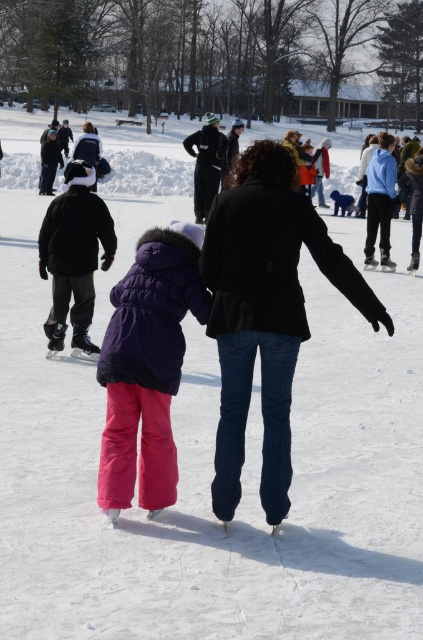
Question: Among these objects, which one is farthest from the camera?

Choices:
 (A) matte purple jacket at center
 (B) black matte coat at center

Answer: (A)

Question: Among these points, which one is nearest to the camera?

Choices:
 (A) (225, 502)
 (B) (167, 436)

Answer: (A)

Question: Does black matte coat at center appear over matte purple jacket at center?

Choices:
 (A) yes
 (B) no

Answer: (A)

Question: Does black matte coat at center have a larger size compared to matte purple jacket at center?

Choices:
 (A) no
 (B) yes

Answer: (B)

Question: Does black matte coat at center lie in front of matte purple jacket at center?

Choices:
 (A) yes
 (B) no

Answer: (A)